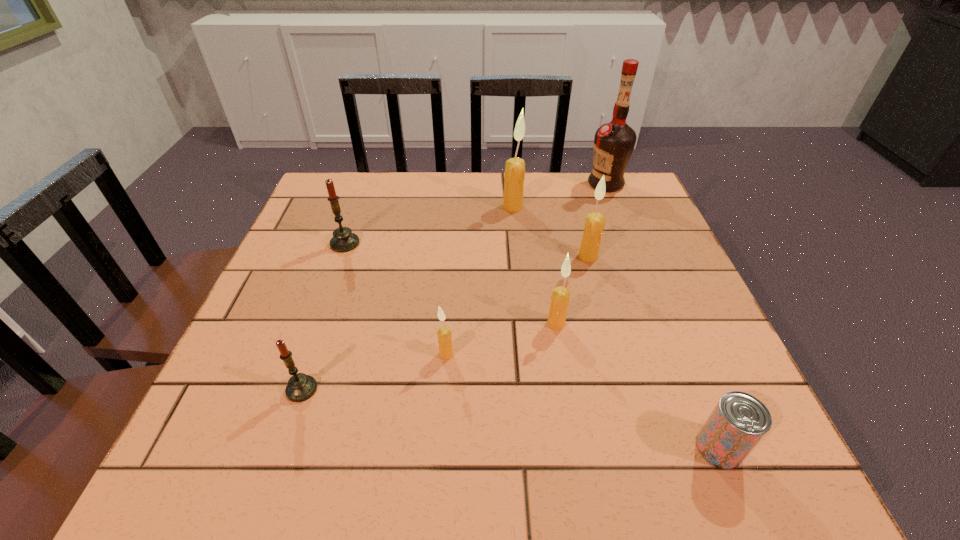
Locate an element on the screen. candle that can be found as the fourth closest to the smaller red candle is located at coordinates 594,225.

The width and height of the screenshot is (960, 540). Find the location of `candle identified as the second closest to the nearer red candle`. candle identified as the second closest to the nearer red candle is located at coordinates pos(343,240).

This screenshot has width=960, height=540. Identify the location of cream candle identified as the third closest to the third cream candle from left to right. (514, 176).

I want to click on cream candle that is the closest to the third farthest cream candle, so click(x=594, y=225).

You are a GUI agent. You are given a task and a screenshot of the screen. Output one action in this format:
    pyautogui.click(x=<x>, y=<y>)
    Task: Click on the vacant area that satisfies the following two spatial constraints: 1. on the front side of the shortest object; 2. on the left side of the third cream candle from left to right
    Image resolution: width=960 pixels, height=540 pixels.
    Given the screenshot: What is the action you would take?
    pyautogui.click(x=577, y=448)

Find the location of a particular element. free region that satisfies the following two spatial constraints: 1. on the front side of the beer can; 2. on the left side of the leftmost cream candle is located at coordinates (440, 448).

Find the location of a particular element. vacant area that satisfies the following two spatial constraints: 1. on the front and back of the tallest object; 2. on the right side of the red beer can is located at coordinates (709, 448).

This screenshot has height=540, width=960. Find the location of `vacant space that satisfies the following two spatial constraints: 1. on the back side of the third cream candle from right to left; 2. on the right side of the seventh farthest object`. vacant space that satisfies the following two spatial constraints: 1. on the back side of the third cream candle from right to left; 2. on the right side of the seventh farthest object is located at coordinates click(364, 207).